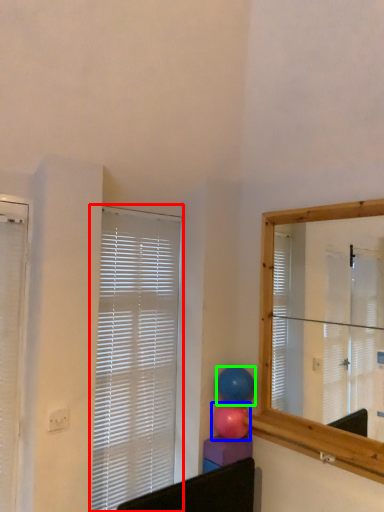
Question: Which object is positioned farthest from window blind (highlighted by a red box)? Select from balloon (highlighted by a blue box) and balloon (highlighted by a green box).

Choices:
 (A) balloon
 (B) balloon

Answer: (A)